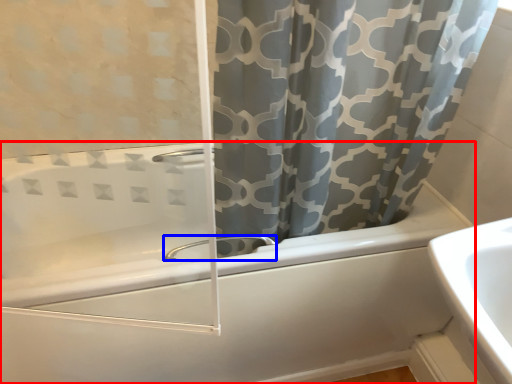
Question: Among these objects, which one is nearest to the camera, bathtub (highlighted by a red box) or tap (highlighted by a blue box)?

Choices:
 (A) bathtub
 (B) tap

Answer: (A)